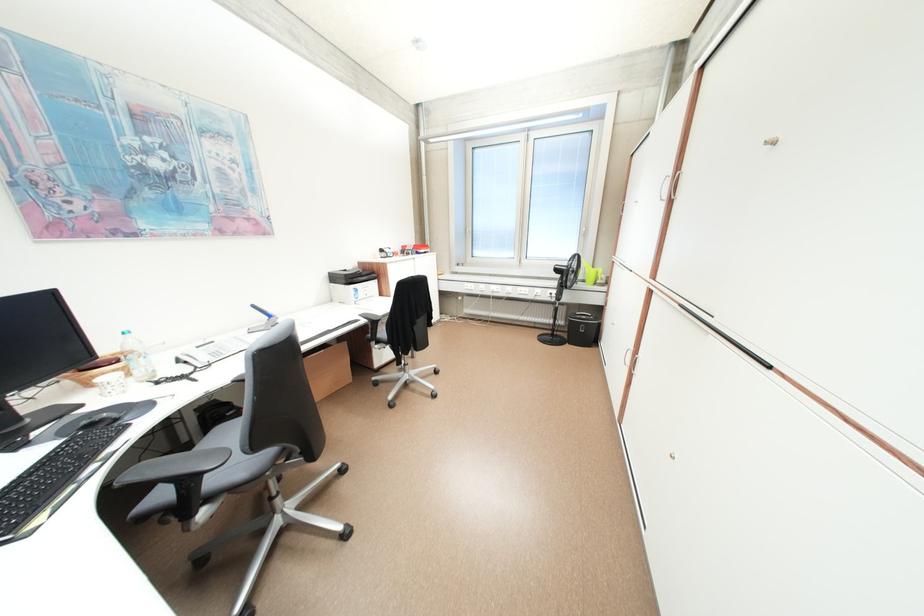
At what (x,y) coordinates should I click in order to perform the action: click on blue stapler. Please return your answer as a coordinate pair (x, y). The height and width of the screenshot is (616, 924). Looking at the image, I should click on (262, 320).